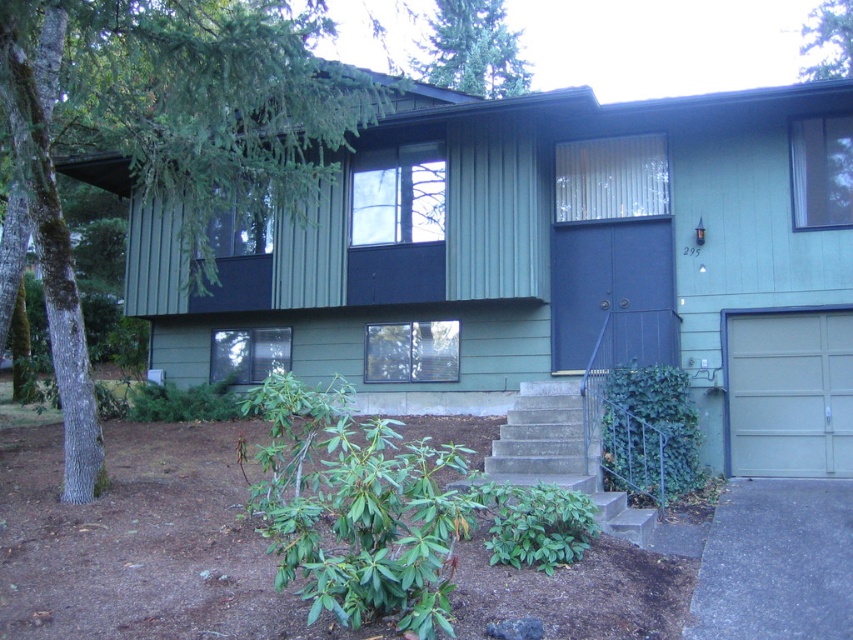
You are standing in front of the house and notice two points marked on the exterior. The first point is at coordinates point (x=468, y=29), and the second is at point (x=837, y=1). Which point is closer to you?

Point (x=468, y=29) is closer to you because it is further to the viewer than point (x=837, y=1).